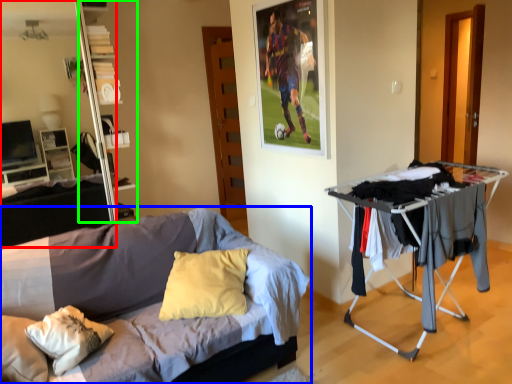
Question: Based on their relative distances, which object is farther from entertainment center (highlighted by a red box)? Choose from bed (highlighted by a blue box) and shelf (highlighted by a green box).

Choices:
 (A) bed
 (B) shelf

Answer: (A)